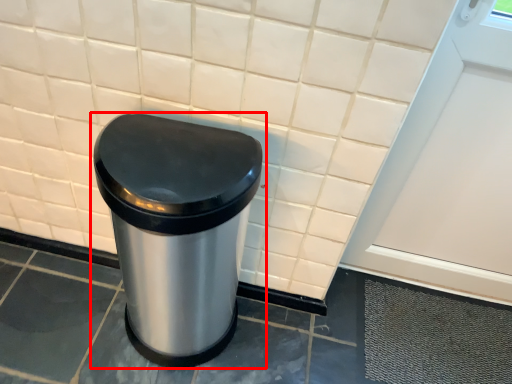
Question: From the image's perspective, where is waste container (annotated by the red box) located in relation to screen door in the image?

Choices:
 (A) below
 (B) above

Answer: (A)